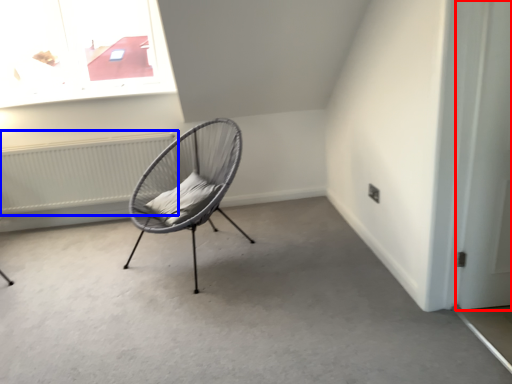
Question: Which point is further to the camera, door (highlighted by a red box) or radiator (highlighted by a blue box)?

Choices:
 (A) door
 (B) radiator

Answer: (B)